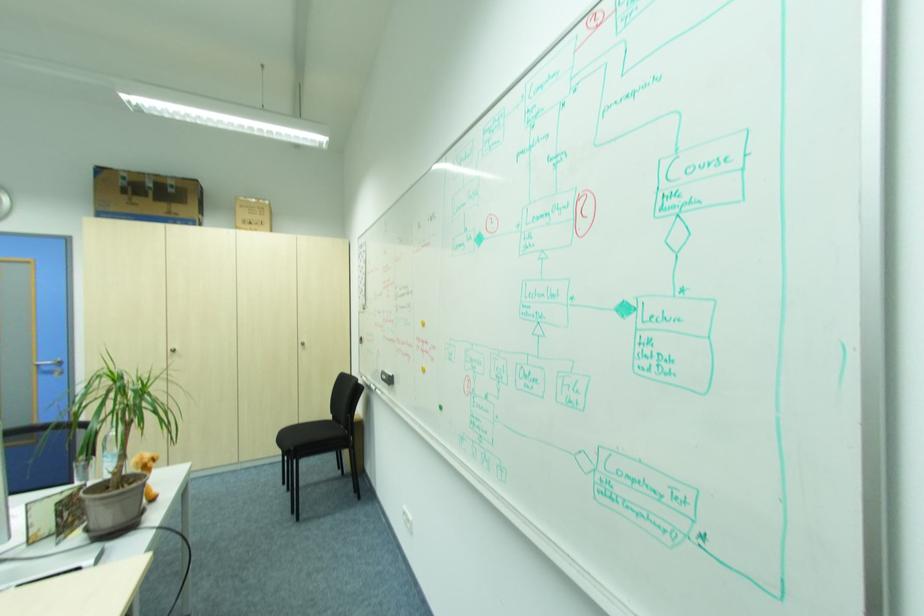
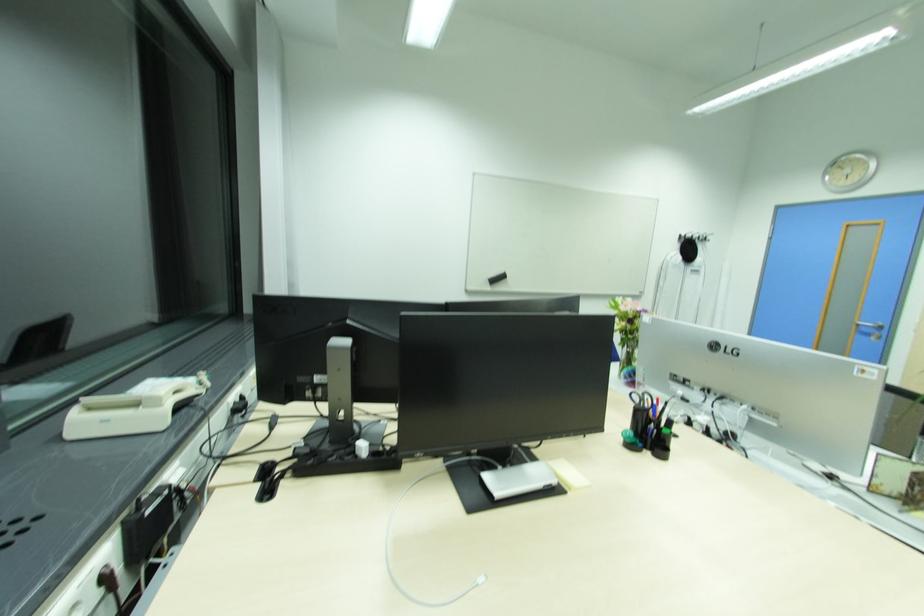
Question: The images are taken continuously from a first-person perspective. In which direction is your viewpoint rotating?

Choices:
 (A) Left
 (B) Right
 (C) Up
 (D) Down

Answer: (A)